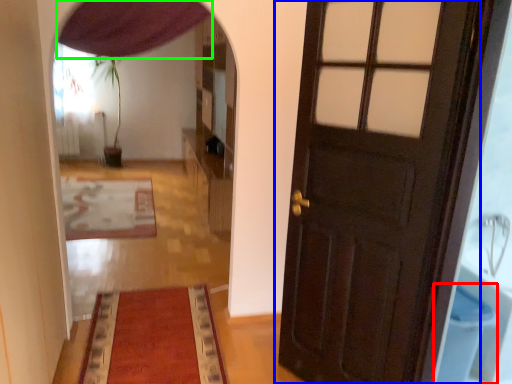
Question: Which object is positioned closest to toilet bowl (highlighted by a red box)? Select from door (highlighted by a blue box) and curtain (highlighted by a green box).

Choices:
 (A) door
 (B) curtain

Answer: (A)